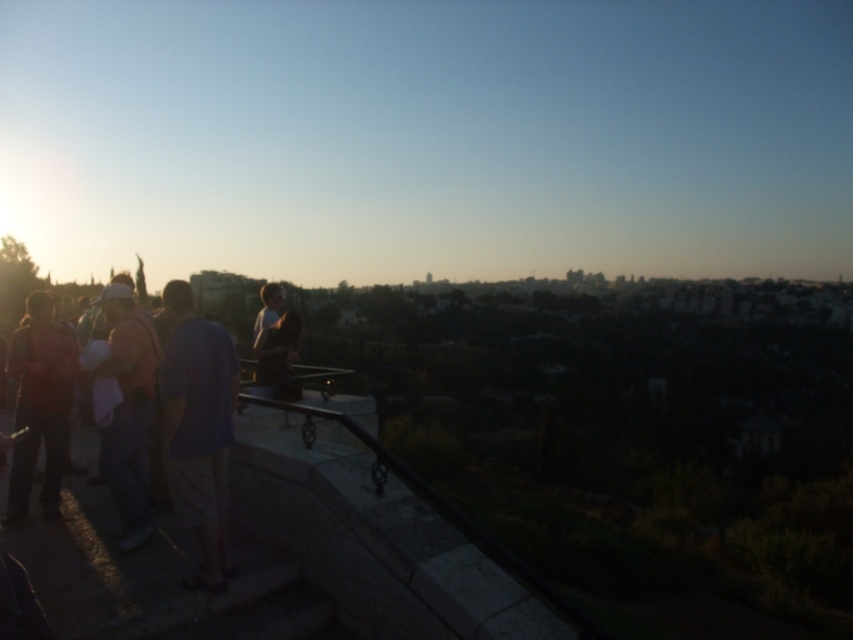
Question: Which object appears farthest from the camera in this image?

Choices:
 (A) blue cotton shirt at center
 (B) matte black shirt at left
 (C) light brown fabric shirt at left

Answer: (B)

Question: Does blue cotton shirt at center have a lesser width compared to light brown fabric shirt at left?

Choices:
 (A) yes
 (B) no

Answer: (A)

Question: Which point is farther to the camera?

Choices:
 (A) light brown fabric shirt at left
 (B) matte black shirt at left

Answer: (B)

Question: Which point is closer to the camera?

Choices:
 (A) (57, 483)
 (B) (136, 356)

Answer: (B)

Question: Is light brown fabric shirt at left wider than matte black shirt at left?

Choices:
 (A) no
 (B) yes

Answer: (A)

Question: Is blue cotton shirt at center below matte black shirt at left?

Choices:
 (A) yes
 (B) no

Answer: (B)